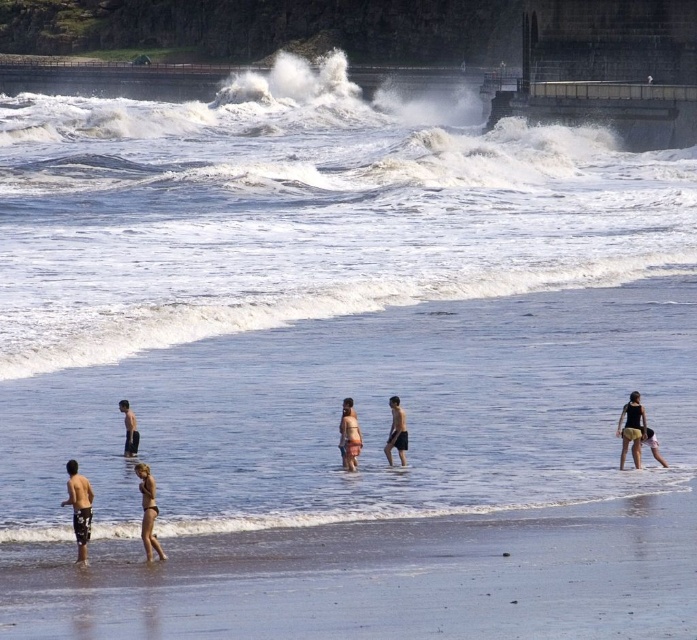
You are a photographer standing at the edge of the beach, and you want to capture a photo of the gold fabric shorts at lower right and the tan skin human at lower right. The camera you are using has a maximum focus range of 12 inches. Can you focus on both subjects clearly without moving closer?

The distance between the gold fabric shorts at lower right and the tan skin human at lower right is 12.52 inches. Since the camera can only focus up to 12 inches, the subjects are slightly out of the focus range. You might need to move closer to ensure both are in focus.

You are a photographer positioned at the beach scene. You want to capture a photo that includes both the gold fabric shorts at lower right and the black matte shorts at center. Which set of shorts will appear larger in the photo?

The gold fabric shorts at lower right will appear larger in the photo because they are closer to the viewer than the black matte shorts at center.

You are a photographer trying to capture a photo of the gold fabric shorts at lower right and the tan skin human at lower right. Since you want to ensure both are fully visible in the frame, which object should you adjust your camera angle to prioritize focusing on?

The gold fabric shorts at lower right are wider than the tan skin human at lower right, so you should prioritize focusing on the gold fabric shorts at lower right to ensure both fit in the frame.